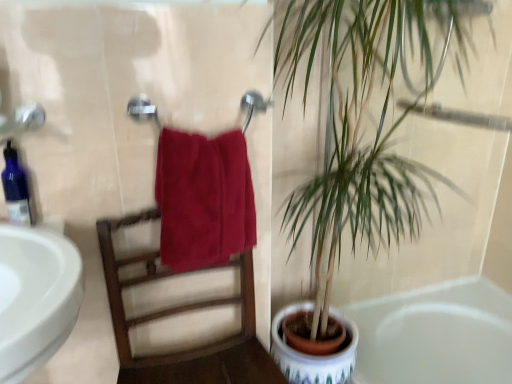
Question: From a real-world perspective, is blue glass soap dispenser at left positioned under satin red towel at center based on gravity?

Choices:
 (A) no
 (B) yes

Answer: (A)

Question: Does blue glass soap dispenser at left lie in front of satin red towel at center?

Choices:
 (A) no
 (B) yes

Answer: (A)

Question: Is blue glass soap dispenser at left turned away from satin red towel at center?

Choices:
 (A) no
 (B) yes

Answer: (A)

Question: From the image's perspective, is blue glass soap dispenser at left located beneath satin red towel at center?

Choices:
 (A) yes
 (B) no

Answer: (B)

Question: From a real-world perspective, is blue glass soap dispenser at left on satin red towel at center?

Choices:
 (A) no
 (B) yes

Answer: (B)

Question: Does blue glass soap dispenser at left have a larger size compared to satin red towel at center?

Choices:
 (A) no
 (B) yes

Answer: (A)

Question: Does green leafy plant at right have a lesser height compared to matte metal towel bar at center?

Choices:
 (A) no
 (B) yes

Answer: (A)

Question: From the image's perspective, is green leafy plant at right under matte metal towel bar at center?

Choices:
 (A) yes
 (B) no

Answer: (A)

Question: From a real-world perspective, is green leafy plant at right physically above matte metal towel bar at center?

Choices:
 (A) no
 (B) yes

Answer: (A)

Question: Are green leafy plant at right and matte metal towel bar at center beside each other?

Choices:
 (A) yes
 (B) no

Answer: (B)

Question: Considering the relative sizes of green leafy plant at right and matte metal towel bar at center in the image provided, is green leafy plant at right thinner than matte metal towel bar at center?

Choices:
 (A) no
 (B) yes

Answer: (A)

Question: Would you consider green leafy plant at right to be distant from matte metal towel bar at center?

Choices:
 (A) no
 (B) yes

Answer: (A)

Question: Considering the relative sizes of wooden chair at center and matte metal towel bar at center in the image provided, is wooden chair at center bigger than matte metal towel bar at center?

Choices:
 (A) yes
 (B) no

Answer: (A)